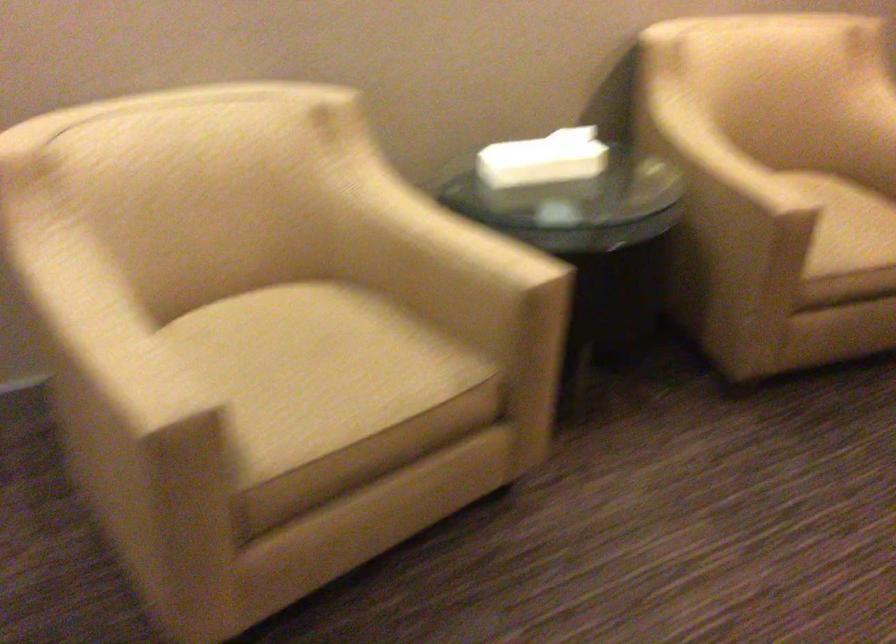
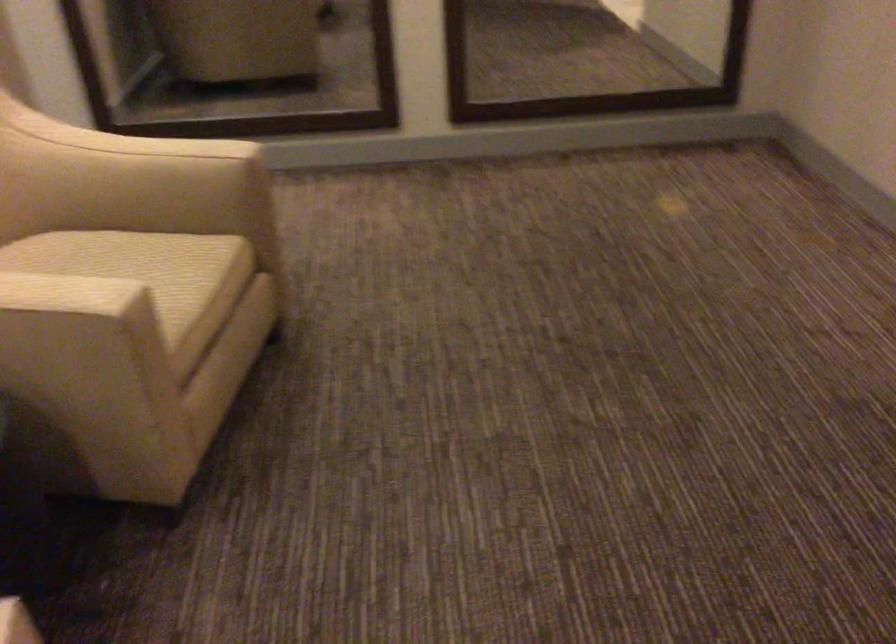
Question: I am providing you with two images of the same scene from different viewpoints. After the viewpoint changes to image2, which objects are now occluded?

Choices:
 (A) beige chair sitting surface
 (B) chair sitting surface
 (C) white handbag
 (D) chair armrest

Answer: (A)